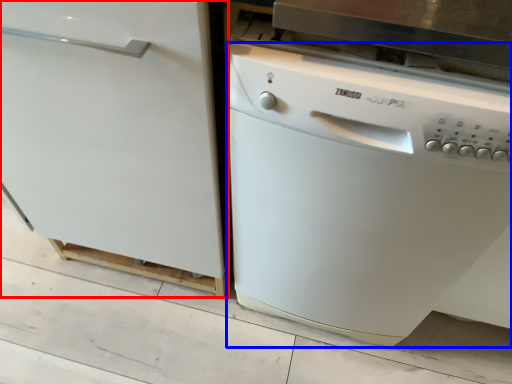
Question: Which object is closer to the camera taking this photo, home appliance (highlighted by a red box) or dish washer (highlighted by a blue box)?

Choices:
 (A) home appliance
 (B) dish washer

Answer: (B)